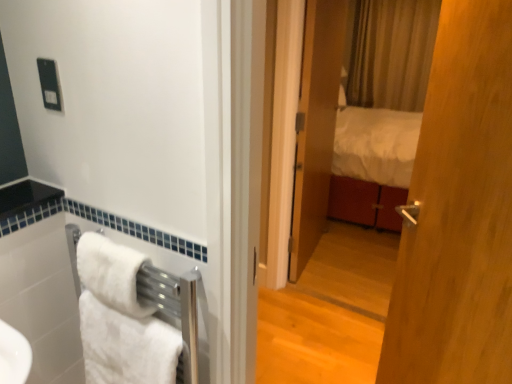
Where is `vacant area situated below matte wooden mirror at center (from a real-world perspective)`? Image resolution: width=512 pixels, height=384 pixels. vacant area situated below matte wooden mirror at center (from a real-world perspective) is located at coordinates (332, 306).